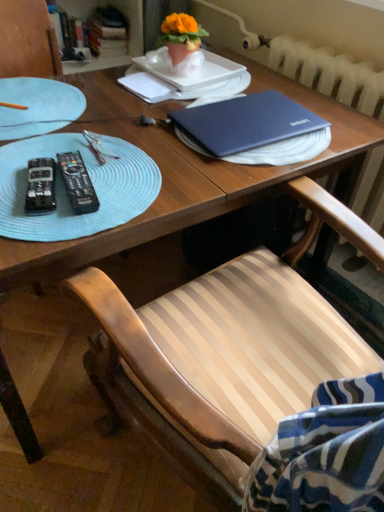
Identify the location of vacant space that's between light blue textured glass plate at left, the second glass plate when ordered from bottom to top, and white paper at upper center. Image resolution: width=384 pixels, height=512 pixels. (113, 99).